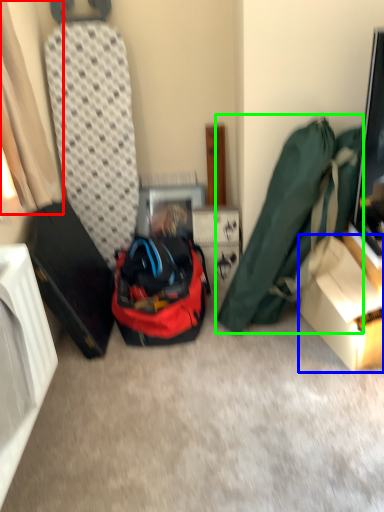
Question: Which object is positioned closest to curtain (highlighted by a red box)? Select from box (highlighted by a blue box) and luggage and bags (highlighted by a green box).

Choices:
 (A) box
 (B) luggage and bags

Answer: (B)